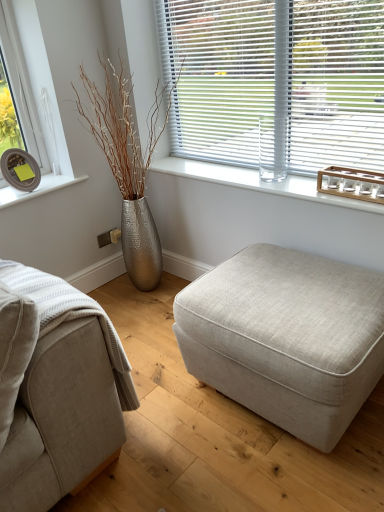
Question: In the image, is beige fabric couch at lower left positioned in front of or behind white plastic blinds at upper center?

Choices:
 (A) front
 (B) behind

Answer: (A)

Question: In terms of size, does beige fabric couch at lower left appear bigger or smaller than white plastic blinds at upper center?

Choices:
 (A) big
 (B) small

Answer: (A)

Question: Which of these objects is positioned closest to the beige fabric ottoman at center?

Choices:
 (A) beige fabric couch at lower left
 (B) silver textured vase at left
 (C) clear glass at upper center
 (D) white plastic blinds at upper center

Answer: (A)

Question: Estimate the real-world distances between objects in this image. Which object is closer to the silver textured vase at left?

Choices:
 (A) white plastic blinds at upper center
 (B) beige fabric couch at lower left
 (C) beige fabric ottoman at center
 (D) clear glass at upper center

Answer: (D)